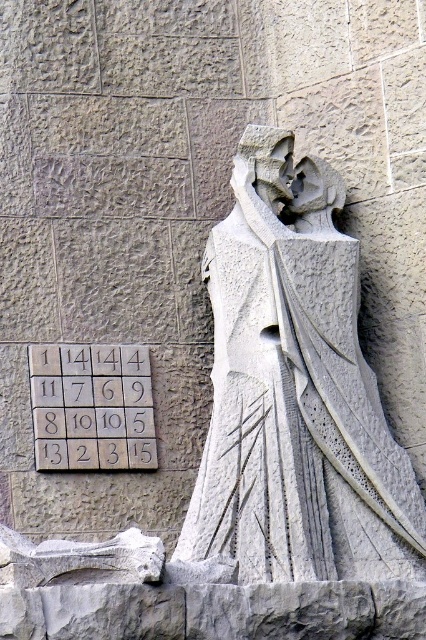
Is white stone statue at center below white stone tiles at center?

No.

Is white stone statue at center above white stone tiles at center?

Yes.

Is point (244, 576) farther from viewer compared to point (81, 369)?

No, (244, 576) is in front of (81, 369).

Where is `white stone statue at center`? The height and width of the screenshot is (640, 426). white stone statue at center is located at coordinates (294, 392).